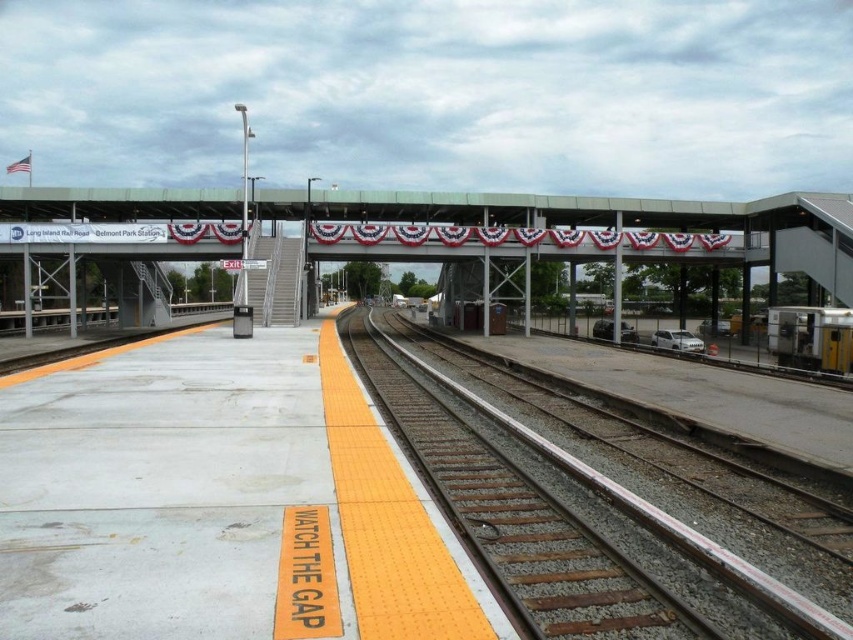
Which is in front, point (94, 513) or point (395, 403)?

Point (94, 513) is in front.

Is yellow tactile paving at center to the left of rusty metal train track at center from the viewer's perspective?

Yes, yellow tactile paving at center is to the left of rusty metal train track at center.

I want to click on yellow tactile paving at center, so click(218, 499).

Is concrete platform at center taller than yellow metallic train at right?

Yes, concrete platform at center is taller than yellow metallic train at right.

Can you confirm if concrete platform at center is bigger than yellow metallic train at right?

Indeed, concrete platform at center has a larger size compared to yellow metallic train at right.

The width and height of the screenshot is (853, 640). Identify the location of concrete platform at center. (544, 205).

Does yellow tactile paving at center have a greater height compared to yellow metallic train at right?

In fact, yellow tactile paving at center may be shorter than yellow metallic train at right.

Which is in front, point (231, 396) or point (792, 316)?

Point (231, 396)

In order to click on yellow tactile paving at center in this screenshot , I will do 218,499.